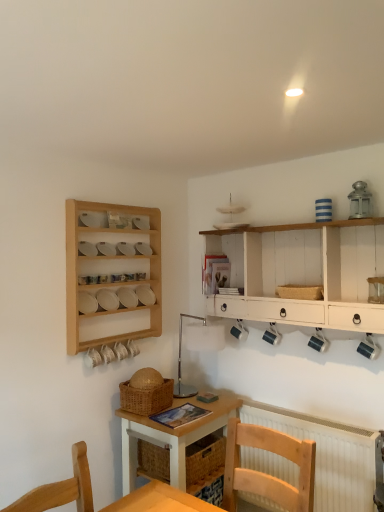
Question: Would you say wooden chair at lower center is part of woven brown basket at center, acting as the first basket starting from the bottom,'s contents?

Choices:
 (A) yes
 (B) no

Answer: (B)

Question: Does woven brown basket at center, positioned as the 1th basket in left-to-right order, lie behind wooden chair at lower center?

Choices:
 (A) yes
 (B) no

Answer: (A)

Question: Does woven brown basket at center, the 2th basket in the top-to-bottom sequence, have a smaller size compared to wooden chair at lower center?

Choices:
 (A) yes
 (B) no

Answer: (A)

Question: Is woven brown basket at center, the 2th basket in the top-to-bottom sequence, at the right side of wooden chair at lower center?

Choices:
 (A) yes
 (B) no

Answer: (B)

Question: Is woven brown basket at center, positioned as the 1th basket in left-to-right order, looking in the opposite direction of wooden chair at lower center?

Choices:
 (A) yes
 (B) no

Answer: (B)

Question: From a real-world perspective, is woven brown basket at center, positioned as the 1th basket in left-to-right order, below wooden chair at lower center?

Choices:
 (A) no
 (B) yes

Answer: (A)

Question: Considering the relative sizes of light wood desk at center and woven straw basket at upper center, the second basket from the bottom, in the image provided, is light wood desk at center wider than woven straw basket at upper center, the second basket from the bottom,?

Choices:
 (A) no
 (B) yes

Answer: (B)

Question: From the image's perspective, would you say light wood desk at center is shown under woven straw basket at upper center, the second basket from the bottom?

Choices:
 (A) yes
 (B) no

Answer: (A)

Question: Is light wood desk at center with woven straw basket at upper center, marked as the 1th basket in a right-to-left arrangement?

Choices:
 (A) no
 (B) yes

Answer: (A)

Question: From a real-world perspective, is light wood desk at center located higher than woven straw basket at upper center, marked as the 1th basket in a right-to-left arrangement?

Choices:
 (A) no
 (B) yes

Answer: (A)

Question: Is light wood desk at center turned away from woven straw basket at upper center, placed as the second basket when sorted from left to right?

Choices:
 (A) yes
 (B) no

Answer: (B)

Question: Does light wood desk at center have a smaller size compared to woven straw basket at upper center, placed as the second basket when sorted from left to right?

Choices:
 (A) yes
 (B) no

Answer: (B)

Question: From the image's perspective, is white wood shelf at upper right on top of white textured radiator at lower right?

Choices:
 (A) yes
 (B) no

Answer: (A)